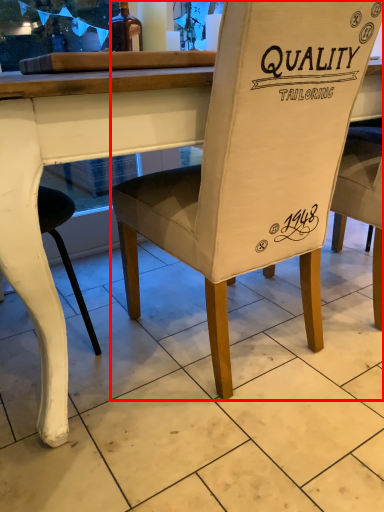
Question: In this image, where is chair (annotated by the red box) located relative to bottle?

Choices:
 (A) right
 (B) left

Answer: (A)